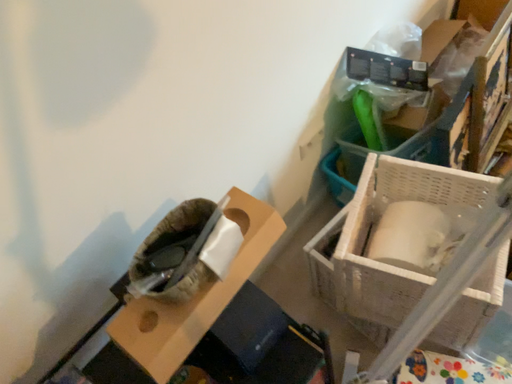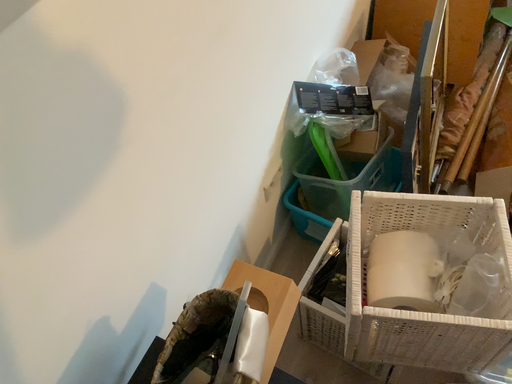
Question: How did the camera likely rotate when shooting the video?

Choices:
 (A) rotated right
 (B) rotated left

Answer: (A)